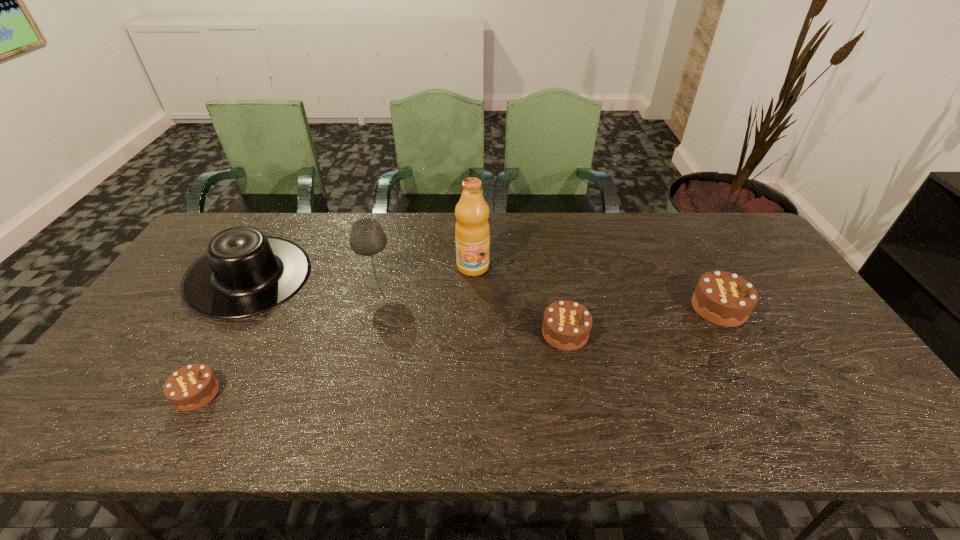
Locate an element on the screen. free space that is in between the second chocolate cake from right to left and the nearest object is located at coordinates (x=381, y=363).

The image size is (960, 540). What are the coordinates of `unoccupied area between the wineglass and the dress hat` in the screenshot? It's located at (313, 279).

You are a GUI agent. You are given a task and a screenshot of the screen. Output one action in this format:
    pyautogui.click(x=<x>, y=<y>)
    Task: Click on the vacant space that is in between the rightmost object and the fifth tallest object
    
    Given the screenshot: What is the action you would take?
    pyautogui.click(x=642, y=320)

Identify the location of empty space that is in between the rightmost object and the fifth object from left to right. The width and height of the screenshot is (960, 540). (642, 320).

In order to click on free space between the fruit juice and the third tallest object in this screenshot , I will do `click(361, 272)`.

Locate which object is the second closest to the third object from right to left. Please provide its 2D coordinates. Your answer should be formatted as a tuple, i.e. [(x, y)], where the tuple contains the x and y coordinates of a point satisfying the conditions above.

[(566, 326)]

Identify the location of the second closest object to the third tallest object. (191, 387).

Locate which chocolate cake is the second closest to the fifth shortest object. Please provide its 2D coordinates. Your answer should be formatted as a tuple, i.e. [(x, y)], where the tuple contains the x and y coordinates of a point satisfying the conditions above.

[(566, 326)]

Identify the location of chocolate cake that is the third closest to the fruit juice. (191, 387).

Locate an element on the screen. free space that satisfies the following two spatial constraints: 1. on the front side of the rightmost chocolate cake; 2. on the left side of the wineglass is located at coordinates (370, 308).